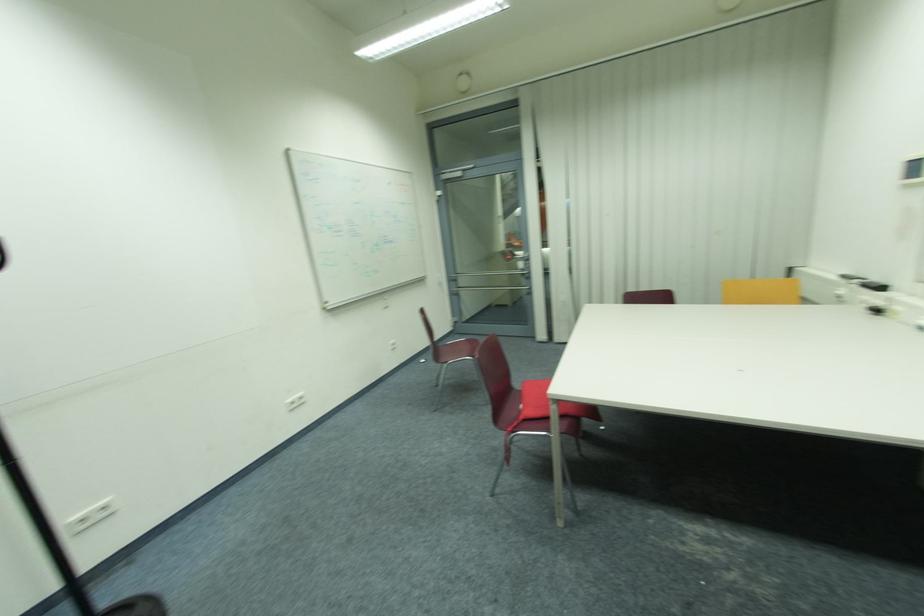
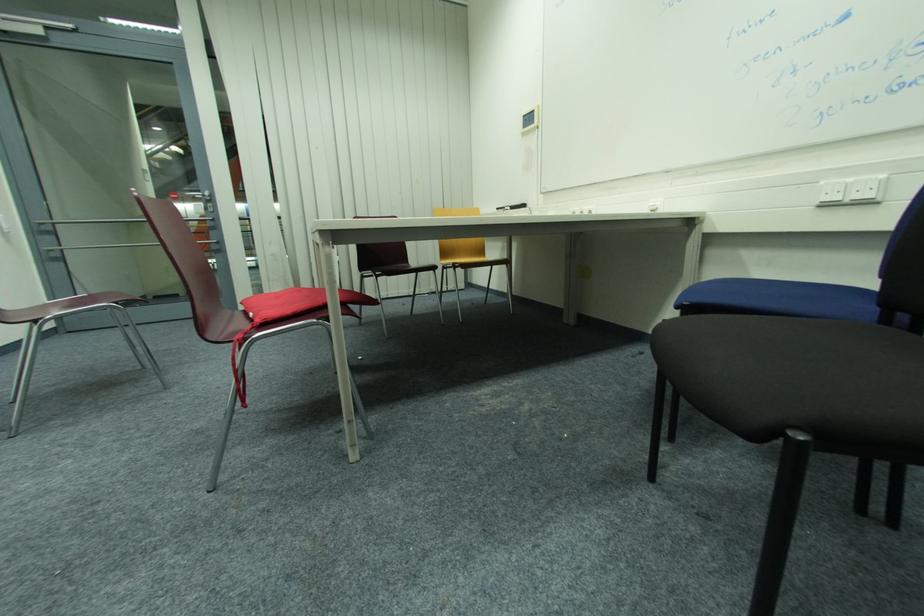
Question: The camera is either moving clockwise (left) or counter-clockwise (right) around the object. The first image is from the beginning of the video and the second image is from the end. Is the camera moving left or right when shooting the video?

Choices:
 (A) Left
 (B) Right

Answer: (A)